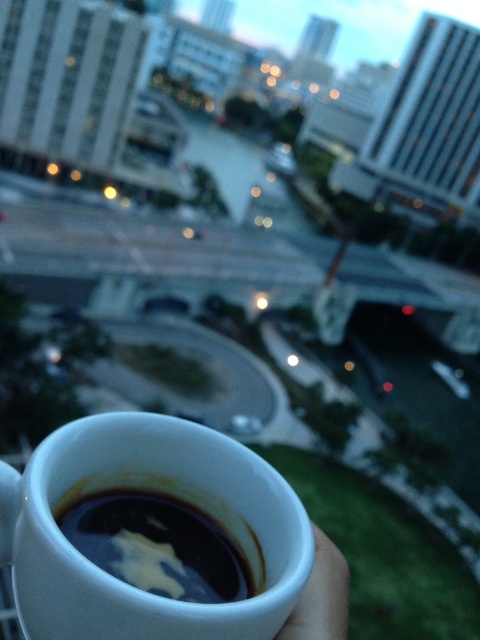
You are at a cafe and see two cups on the table. The white glossy mug at lower center and the black glossy coffee cup at lower center. Which one is positioned more to the left?

The white glossy mug at lower center is positioned to the left of the black glossy coffee cup at lower center.

You are holding a white ceramic cup filled with coffee and want to place it on a table. The table is located at point (255, 468). If the table is 25 centimeters away from you, can you place the cup there without moving closer?

The distance of point (255, 468) from camera is 26.36 centimeters. Since the table is 26.36 cm away and you need to reach 25 cm, you are slightly too far to place the cup there without moving closer.